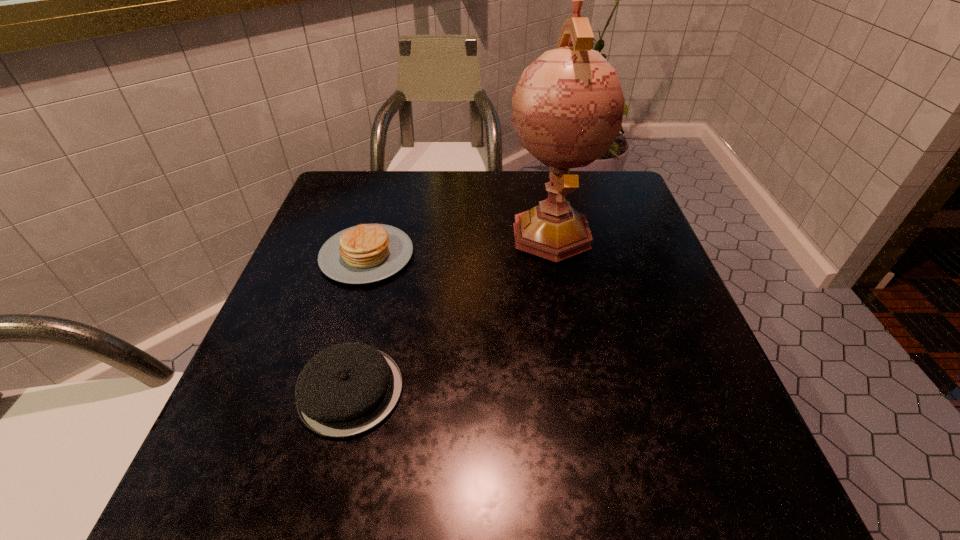
This screenshot has width=960, height=540. In order to click on the tallest object in this screenshot , I will do `click(567, 108)`.

Locate an element on the screen. This screenshot has width=960, height=540. globe is located at coordinates (567, 108).

The height and width of the screenshot is (540, 960). I want to click on the farther pancake, so point(366,253).

You are a GUI agent. You are given a task and a screenshot of the screen. Output one action in this format:
    pyautogui.click(x=<x>, y=<y>)
    Task: Click on the nearest object
    
    Given the screenshot: What is the action you would take?
    pyautogui.click(x=345, y=390)

What are the coordinates of `vacant space located 0.080m on the front-facing side of the globe` in the screenshot? It's located at [564, 299].

Find the location of `free space located on the back of the farther pancake`. free space located on the back of the farther pancake is located at coordinates (391, 172).

Locate an element on the screen. free region located 0.320m on the back of the nearest object is located at coordinates (388, 238).

This screenshot has width=960, height=540. What are the coordinates of `object that is at the far edge` in the screenshot? It's located at (567, 108).

The width and height of the screenshot is (960, 540). Identify the location of object that is at the right edge. point(567,108).

This screenshot has height=540, width=960. What are the coordinates of `object located at the far right corner` in the screenshot? It's located at (567, 108).